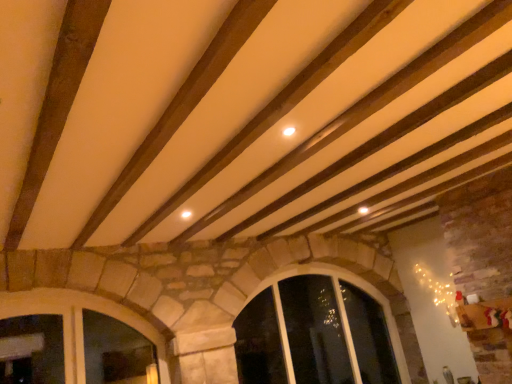
Question: Which direction should I rotate to look at clear glass window at center, placed as the second window when sorted from left to right?

Choices:
 (A) left
 (B) right

Answer: (B)

Question: Can you confirm if clear glass window at center, placed as the second window when sorted from left to right, is positioned to the left of stone textured window at lower left, the first window in the left-to-right sequence?

Choices:
 (A) no
 (B) yes

Answer: (A)

Question: Could you tell me if clear glass window at center, placed as the second window when sorted from left to right, is facing stone textured window at lower left, which appears as the 2th window when viewed from the back?

Choices:
 (A) no
 (B) yes

Answer: (A)

Question: Considering the relative positions of clear glass window at center, acting as the second window starting from the front, and stone textured window at lower left, which is counted as the 1th window, starting from the front, in the image provided, is clear glass window at center, acting as the second window starting from the front, to the right of stone textured window at lower left, which is counted as the 1th window, starting from the front, from the viewer's perspective?

Choices:
 (A) no
 (B) yes

Answer: (B)

Question: Are clear glass window at center, placed as the second window when sorted from left to right, and stone textured window at lower left, which appears as the 2th window when viewed from the back, located far from each other?

Choices:
 (A) no
 (B) yes

Answer: (B)

Question: Is the position of clear glass window at center, placed as the second window when sorted from left to right, more distant than that of stone textured window at lower left, the first window in the left-to-right sequence?

Choices:
 (A) yes
 (B) no

Answer: (A)

Question: Is clear glass window at center, placed as the second window when sorted from left to right, bigger than stone textured window at lower left, positioned as the 2th window in right-to-left order?

Choices:
 (A) yes
 (B) no

Answer: (A)

Question: Is the position of stone textured window at lower left, which is counted as the 1th window, starting from the front, less distant than that of clear glass window at center, placed as the second window when sorted from left to right?

Choices:
 (A) yes
 (B) no

Answer: (A)

Question: Are stone textured window at lower left, the first window in the left-to-right sequence, and clear glass window at center, placed as the second window when sorted from left to right, far apart?

Choices:
 (A) yes
 (B) no

Answer: (A)

Question: Is stone textured window at lower left, which appears as the 2th window when viewed from the back, oriented away from clear glass window at center, acting as the second window starting from the front?

Choices:
 (A) no
 (B) yes

Answer: (A)

Question: Does stone textured window at lower left, positioned as the 2th window in right-to-left order, have a larger size compared to clear glass window at center, placed as the second window when sorted from left to right?

Choices:
 (A) no
 (B) yes

Answer: (A)

Question: Is stone textured window at lower left, which is counted as the 1th window, starting from the front, shorter than clear glass window at center, which is counted as the first window, starting from the back?

Choices:
 (A) yes
 (B) no

Answer: (A)

Question: From the image's perspective, is stone textured window at lower left, positioned as the 2th window in right-to-left order, over clear glass window at center, which ranks as the first window in right-to-left order?

Choices:
 (A) yes
 (B) no

Answer: (A)

Question: Considering the positions of point (140, 317) and point (287, 352), is point (140, 317) closer or farther from the camera than point (287, 352)?

Choices:
 (A) farther
 (B) closer

Answer: (B)